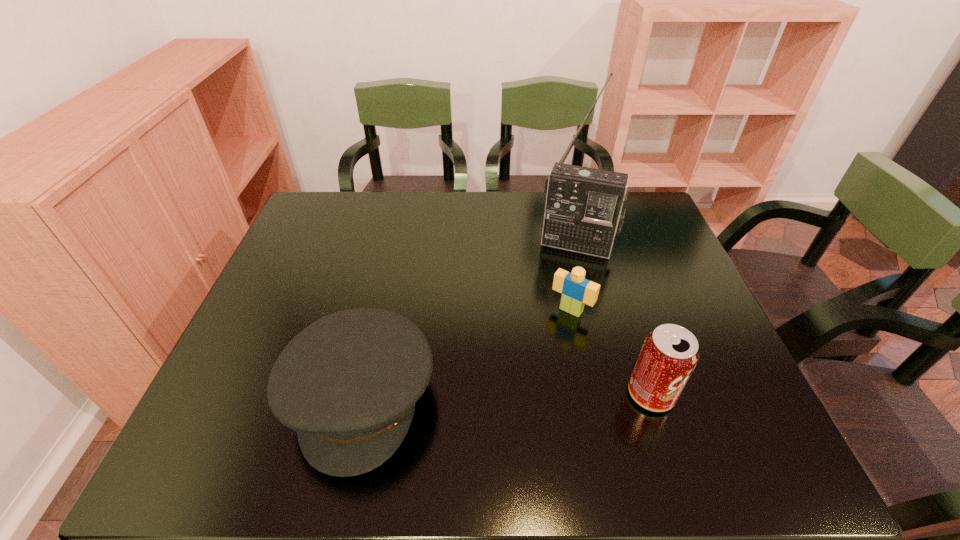
Identify the location of vacant space at the left edge of the desktop. This screenshot has width=960, height=540. (298, 253).

This screenshot has width=960, height=540. What are the coordinates of `vacant space at the right edge` in the screenshot? It's located at (655, 278).

In the image, there is a desktop. Where is `free space at the far left corner`? This screenshot has width=960, height=540. free space at the far left corner is located at coordinates pyautogui.click(x=327, y=195).

Locate an element on the screen. This screenshot has height=540, width=960. vacant space at the near left corner of the desktop is located at coordinates (268, 413).

In the image, there is a desktop. Identify the location of free space at the far right corner. The height and width of the screenshot is (540, 960). (641, 222).

I want to click on empty space that is in between the farthest object and the soda can, so click(x=614, y=319).

Locate an element on the screen. empty space that is in between the soda can and the Lego is located at coordinates (612, 352).

This screenshot has width=960, height=540. Identify the location of vacant area between the Lego and the beret. (466, 354).

Find the location of a particular element. free point between the second tallest object and the tallest object is located at coordinates (614, 319).

Where is `free point between the beret and the second tallest object`? This screenshot has width=960, height=540. free point between the beret and the second tallest object is located at coordinates (506, 396).